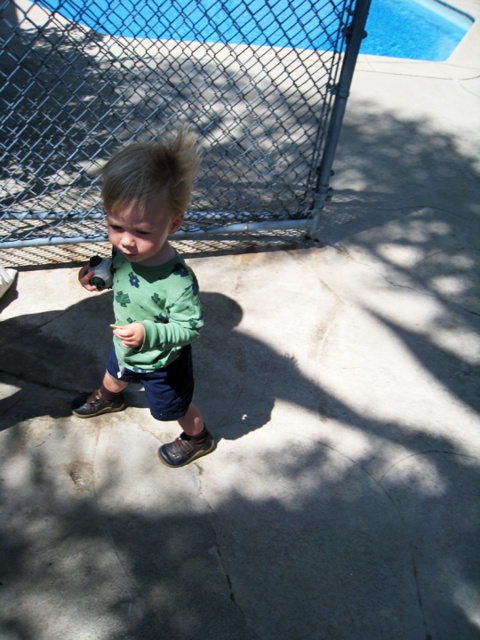
You are a photographer trying to capture a clear shot of the blonde fuzzy hair at center and the blue glass pool at upper center. Which object should you focus on first if you want to ensure both are in focus without adjusting your camera settings?

You should focus on the blue glass pool at upper center first because it is closer to you than the blonde fuzzy hair at center, so focusing on the closer object allows the background object to be in focus as well.

Consider the image. You are a parent trying to ensure your child is safe near the pool. The child is standing near the blue glass pool at upper center and the blonde fuzzy hair at center. How far apart are the child and the pool?

The blue glass pool at upper center is 5.59 meters away from the blonde fuzzy hair at center, so the distance between the child and the pool is 5.59 meters.